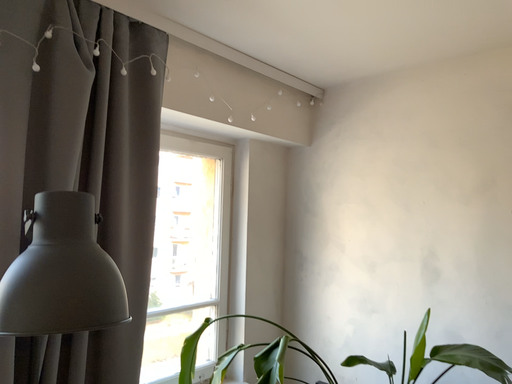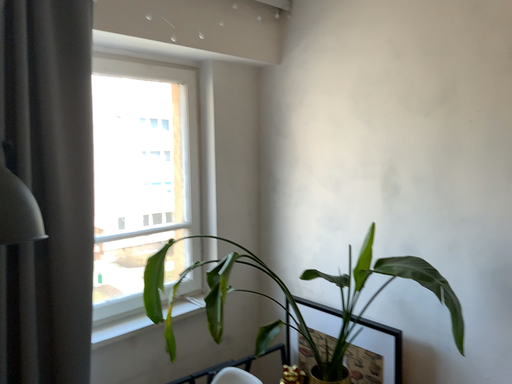
Question: How did the camera likely rotate when shooting the video?

Choices:
 (A) rotated downward
 (B) rotated upward

Answer: (A)